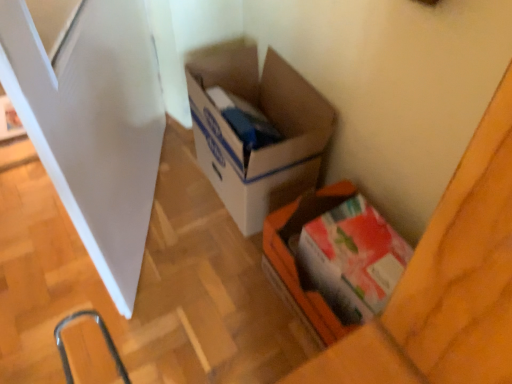
Question: Is white glossy screen door at left thinner than matte cardboard box at lower right, which appears as the first box when viewed from the front?

Choices:
 (A) yes
 (B) no

Answer: (A)

Question: From a real-world perspective, is white glossy screen door at left on top of matte cardboard box at lower right, which appears as the first box when viewed from the front?

Choices:
 (A) yes
 (B) no

Answer: (A)

Question: Is white glossy screen door at left outside of matte cardboard box at lower right, the second box from the back?

Choices:
 (A) no
 (B) yes

Answer: (B)

Question: Can you see white glossy screen door at left touching matte cardboard box at lower right, the second box from the back?

Choices:
 (A) no
 (B) yes

Answer: (A)

Question: Is white glossy screen door at left looking in the opposite direction of matte cardboard box at lower right, which appears as the first box when viewed from the front?

Choices:
 (A) no
 (B) yes

Answer: (B)

Question: Is matte cardboard box at lower right, which appears as the first box when viewed from the front, inside white glossy screen door at left?

Choices:
 (A) no
 (B) yes

Answer: (A)

Question: Is matte cardboard box at lower right, which appears as the first box when viewed from the front, aimed at white glossy screen door at left?

Choices:
 (A) yes
 (B) no

Answer: (B)

Question: Considering the relative sizes of matte cardboard box at lower right, the second box from the back, and white glossy screen door at left in the image provided, is matte cardboard box at lower right, the second box from the back, smaller than white glossy screen door at left?

Choices:
 (A) no
 (B) yes

Answer: (B)

Question: From the image's perspective, is matte cardboard box at lower right, the second box from the back, on top of white glossy screen door at left?

Choices:
 (A) yes
 (B) no

Answer: (B)

Question: Does matte cardboard box at lower right, the second box from the back, have a lesser width compared to white glossy screen door at left?

Choices:
 (A) no
 (B) yes

Answer: (A)

Question: From the image's perspective, is matte cardboard box at lower right, which appears as the first box when viewed from the front, below white glossy screen door at left?

Choices:
 (A) no
 (B) yes

Answer: (B)

Question: Can you confirm if matte cardboard box at lower right, which appears as the first box when viewed from the front, is bigger than white glossy screen door at left?

Choices:
 (A) yes
 (B) no

Answer: (B)

Question: Does cardboard box at center, which is counted as the 1th box, starting from the back, appear on the right side of white glossy screen door at left?

Choices:
 (A) yes
 (B) no

Answer: (A)